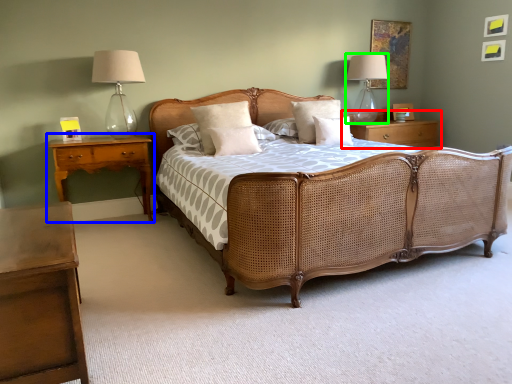
Question: Which object is positioned farthest from nightstand (highlighted by a red box)? Select from nightstand (highlighted by a blue box) and bedside lamp (highlighted by a green box).

Choices:
 (A) nightstand
 (B) bedside lamp

Answer: (A)